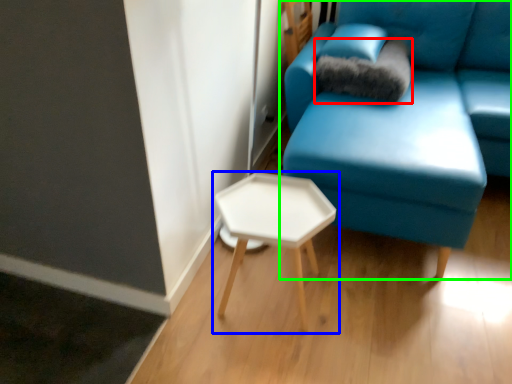
Question: Which object is the farthest from pillow (highlighted by a red box)? Choose among these: table (highlighted by a blue box) or studio couch (highlighted by a green box).

Choices:
 (A) table
 (B) studio couch

Answer: (A)